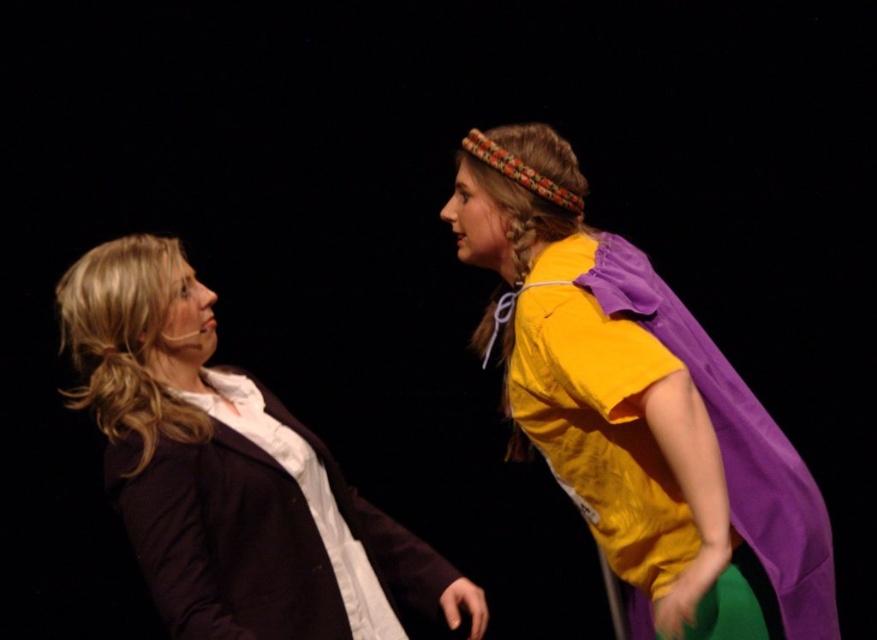
Can you confirm if yellow matte shirt at upper right is positioned to the left of matte black blazer at left?

In fact, yellow matte shirt at upper right is to the right of matte black blazer at left.

Is yellow matte shirt at upper right in front of matte black blazer at left?

Yes, it is in front of matte black blazer at left.

Between point (597, 349) and point (326, 538), which one is positioned in front?

Point (597, 349) is more forward.

You are a GUI agent. You are given a task and a screenshot of the screen. Output one action in this format:
    pyautogui.click(x=<x>, y=<y>)
    Task: Click on the yellow matte shirt at upper right
    The image size is (877, 640).
    Given the screenshot: What is the action you would take?
    pyautogui.click(x=636, y=404)